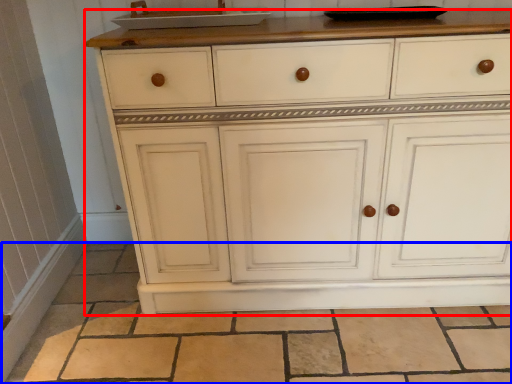
Question: Among these objects, which one is nearest to the camera, chest of drawers (highlighted by a red box) or tile (highlighted by a blue box)?

Choices:
 (A) chest of drawers
 (B) tile

Answer: (A)